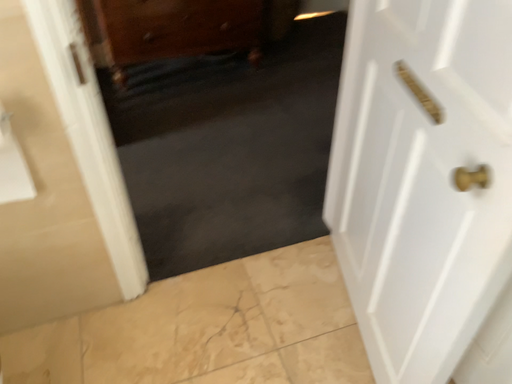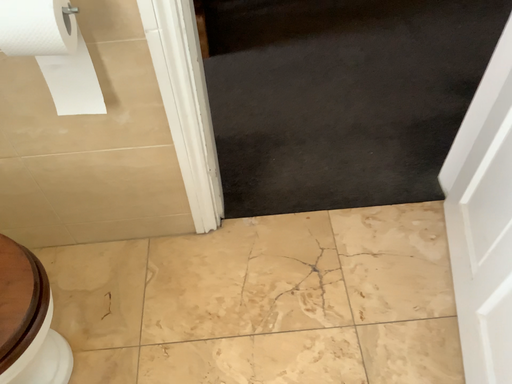
Question: Which way did the camera rotate in the video?

Choices:
 (A) rotated right
 (B) rotated left

Answer: (B)